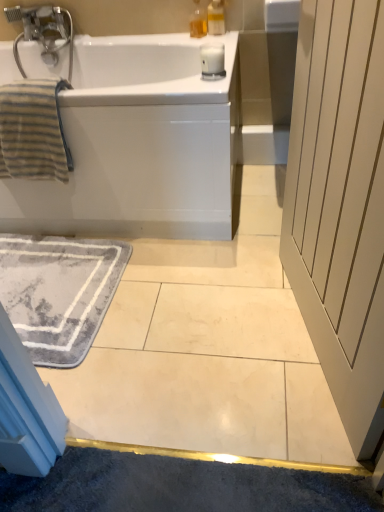
Identify the location of vacant point above gray soft rug at lower left (from a real-world perspective). The width and height of the screenshot is (384, 512). (55, 285).